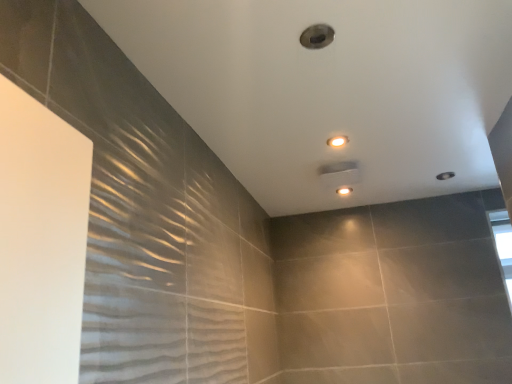
What do you see at coordinates (344, 191) in the screenshot? The width and height of the screenshot is (512, 384). I see `matte white light fixture at upper center` at bounding box center [344, 191].

Find the location of a particular element. matte white light fixture at upper center is located at coordinates (344, 191).

Locate an element on the screen. The width and height of the screenshot is (512, 384). matte white light fixture at upper center is located at coordinates (344, 191).